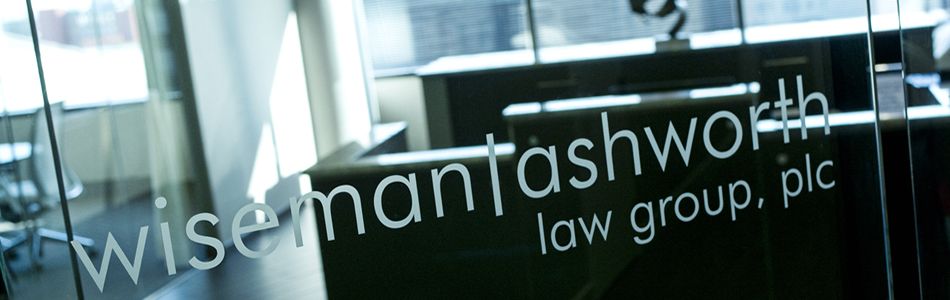
Find the location of a particular element. round table is located at coordinates [x=3, y=150].